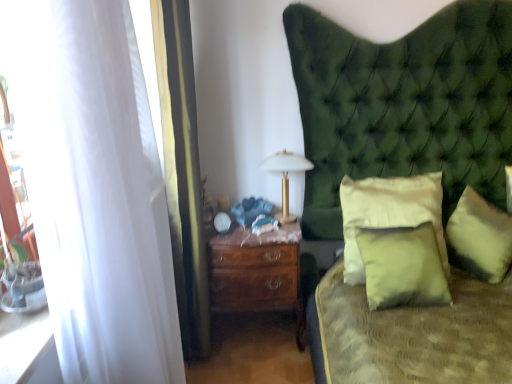
What are the coordinates of `soft cream pillow at center, which appears as the 2th pillow when viewed from the right` in the screenshot? It's located at (389, 213).

Measure the distance between point (265, 158) and camera.

They are 2.44 meters apart.

How much space does soft yellow fabric pillow at right, which is the 1th pillow in right-to-left order, occupy vertically?

soft yellow fabric pillow at right, which is the 1th pillow in right-to-left order, is 14.60 inches tall.

The image size is (512, 384). I want to click on mahogany wood nightstand at center, so click(x=257, y=272).

How far apart are soft yellow fabric pillow at right, which is the 1th pillow in right-to-left order, and white sheer curtain at left, placed as the second curtain when sorted from back to front?

The distance of soft yellow fabric pillow at right, which is the 1th pillow in right-to-left order, from white sheer curtain at left, placed as the second curtain when sorted from back to front, is 5.87 feet.

Is point (505, 223) closer to viewer compared to point (115, 200)?

No, it is not.

Between soft yellow fabric pillow at right, which is the 1th pillow in right-to-left order, and white sheer curtain at left, placed as the second curtain when sorted from back to front, which one has smaller size?

soft yellow fabric pillow at right, which is the 1th pillow in right-to-left order.

Does soft yellow fabric pillow at right, acting as the third pillow starting from the left, appear on the left side of white sheer curtain at left, placed as the second curtain when sorted from back to front?

In fact, soft yellow fabric pillow at right, acting as the third pillow starting from the left, is to the right of white sheer curtain at left, placed as the second curtain when sorted from back to front.

Is soft cream pillow at center, placed as the 2th pillow when sorted from left to right, wider or thinner than mahogany wood nightstand at center?

Clearly, soft cream pillow at center, placed as the 2th pillow when sorted from left to right, has less width compared to mahogany wood nightstand at center.

From the image's perspective, does soft cream pillow at center, placed as the 2th pillow when sorted from left to right, appear lower than mahogany wood nightstand at center?

No, from the image's perspective, soft cream pillow at center, placed as the 2th pillow when sorted from left to right, is not beneath mahogany wood nightstand at center.

Which is further, (381, 182) or (213, 244)?

Point (381, 182)

Is soft cream pillow at center, which appears as the 2th pillow when viewed from the right, looking in the opposite direction of mahogany wood nightstand at center?

soft cream pillow at center, which appears as the 2th pillow when viewed from the right, is not turned away from mahogany wood nightstand at center.

Is gold metallic bedside lamp at center far from white sheer curtain at left, the first curtain in the back-to-front sequence?

They are positioned close to each other.

From the image's perspective, which one is positioned lower, gold metallic bedside lamp at center or white sheer curtain at left, the first curtain in the back-to-front sequence?

white sheer curtain at left, the first curtain in the back-to-front sequence, appears lower in the image.

Based on their sizes in the image, would you say gold metallic bedside lamp at center is bigger or smaller than white sheer curtain at left, acting as the 2th curtain starting from the front?

Clearly, gold metallic bedside lamp at center is smaller in size than white sheer curtain at left, acting as the 2th curtain starting from the front.

Are white sheer curtain at left, which is the first curtain from front to back, and mahogany wood nightstand at center making contact?

No, white sheer curtain at left, which is the first curtain from front to back, is not next to mahogany wood nightstand at center.

How different are the orientations of white sheer curtain at left, placed as the second curtain when sorted from back to front, and mahogany wood nightstand at center in degrees?

There is a 89.5-degree angle between the facing directions of white sheer curtain at left, placed as the second curtain when sorted from back to front, and mahogany wood nightstand at center.

Which object is closer to the camera, white sheer curtain at left, which is the first curtain from front to back, or mahogany wood nightstand at center?

white sheer curtain at left, which is the first curtain from front to back, is closer to the camera.

Which object is wider, gold metallic bedside lamp at center or matte green pillow at center, marked as the third pillow in a right-to-left arrangement?

gold metallic bedside lamp at center.

Does gold metallic bedside lamp at center lie in front of matte green pillow at center, marked as the third pillow in a right-to-left arrangement?

No, gold metallic bedside lamp at center is further to the viewer.

Consider the image. Is gold metallic bedside lamp at center at the right side of matte green pillow at center, the 1th pillow from the left?

In fact, gold metallic bedside lamp at center is to the left of matte green pillow at center, the 1th pillow from the left.

Considering the points (85, 283) and (430, 175), which point is in front, point (85, 283) or point (430, 175)?

The point (85, 283) is closer to the camera.

Is white sheer curtain at left, placed as the second curtain when sorted from back to front, bigger or smaller than soft cream pillow at center, which appears as the 2th pillow when viewed from the right?

white sheer curtain at left, placed as the second curtain when sorted from back to front, is bigger than soft cream pillow at center, which appears as the 2th pillow when viewed from the right.

From the image's perspective, which is above, white sheer curtain at left, which is the first curtain from front to back, or soft cream pillow at center, placed as the 2th pillow when sorted from left to right?

soft cream pillow at center, placed as the 2th pillow when sorted from left to right, appears higher in the image.

Would you say white sheer curtain at left, placed as the second curtain when sorted from back to front, is inside or outside soft cream pillow at center, placed as the 2th pillow when sorted from left to right?

white sheer curtain at left, placed as the second curtain when sorted from back to front, is not inside soft cream pillow at center, placed as the 2th pillow when sorted from left to right, it's outside.

Between white sheer curtain at left, acting as the 2th curtain starting from the front, and matte green pillow at center, marked as the third pillow in a right-to-left arrangement, which one has less height?

Standing shorter between the two is matte green pillow at center, marked as the third pillow in a right-to-left arrangement.

Is white sheer curtain at left, acting as the 2th curtain starting from the front, in front of or behind matte green pillow at center, the 1th pillow from the left, in the image?

Visually, white sheer curtain at left, acting as the 2th curtain starting from the front, is located in front of matte green pillow at center, the 1th pillow from the left.

Based on the photo, which is more to the right, white sheer curtain at left, acting as the 2th curtain starting from the front, or matte green pillow at center, marked as the third pillow in a right-to-left arrangement?

From the viewer's perspective, matte green pillow at center, marked as the third pillow in a right-to-left arrangement, appears more on the right side.

Which pillow is the 2nd one when counting from the back of the white sheer curtain at left, placed as the second curtain when sorted from back to front? Please provide its 2D coordinates.

[(479, 238)]

The width and height of the screenshot is (512, 384). Identify the location of nightstand beneath the soft cream pillow at center, placed as the 2th pillow when sorted from left to right (from a real-world perspective). (257, 272).

From the image, which object appears to be nearer to white sheer curtain at left, acting as the 2th curtain starting from the front, soft yellow fabric pillow at right, which is the 1th pillow in right-to-left order, or matte green pillow at center, the 1th pillow from the left?

Among the two, matte green pillow at center, the 1th pillow from the left, is located nearer to white sheer curtain at left, acting as the 2th curtain starting from the front.

Which object lies further to the anchor point gold metallic bedside lamp at center, matte green pillow at center, the 1th pillow from the left, or white sheer curtain at left, the first curtain in the back-to-front sequence?

Based on the image, matte green pillow at center, the 1th pillow from the left, appears to be further to gold metallic bedside lamp at center.

Based on their spatial positions, is soft cream pillow at center, placed as the 2th pillow when sorted from left to right, or gold metallic bedside lamp at center further from mahogany wood nightstand at center?

soft cream pillow at center, placed as the 2th pillow when sorted from left to right.

Estimate the real-world distances between objects in this image. Which object is closer to soft yellow fabric pillow at right, acting as the third pillow starting from the left, white sheer curtain at left, placed as the second curtain when sorted from back to front, or white sheer curtain at left, the first curtain in the back-to-front sequence?

white sheer curtain at left, the first curtain in the back-to-front sequence.

When comparing their distances from white sheer curtain at left, acting as the 2th curtain starting from the front, does matte green pillow at center, marked as the third pillow in a right-to-left arrangement, or gold metallic bedside lamp at center seem further?

Based on the image, matte green pillow at center, marked as the third pillow in a right-to-left arrangement, appears to be further to white sheer curtain at left, acting as the 2th curtain starting from the front.

Estimate the real-world distances between objects in this image. Which object is closer to white sheer curtain at left, the first curtain in the back-to-front sequence, matte green pillow at center, marked as the third pillow in a right-to-left arrangement, or soft cream pillow at center, which appears as the 2th pillow when viewed from the right?

The object closer to white sheer curtain at left, the first curtain in the back-to-front sequence, is soft cream pillow at center, which appears as the 2th pillow when viewed from the right.

Considering their positions, is mahogany wood nightstand at center positioned further to matte green pillow at center, marked as the third pillow in a right-to-left arrangement, than white sheer curtain at left, placed as the second curtain when sorted from back to front?

Among the two, white sheer curtain at left, placed as the second curtain when sorted from back to front, is located further to matte green pillow at center, marked as the third pillow in a right-to-left arrangement.

Looking at the image, which one is located further to mahogany wood nightstand at center, gold metallic bedside lamp at center or matte green pillow at center, the 1th pillow from the left?

Based on the image, matte green pillow at center, the 1th pillow from the left, appears to be further to mahogany wood nightstand at center.

Find the location of `bedside lamp between white sheer curtain at left, the first curtain in the back-to-front sequence, and soft cream pillow at center, which appears as the 2th pillow when viewed from the right, from left to right`. bedside lamp between white sheer curtain at left, the first curtain in the back-to-front sequence, and soft cream pillow at center, which appears as the 2th pillow when viewed from the right, from left to right is located at coordinates (286, 176).

Where is `bedside lamp between mahogany wood nightstand at center and matte green pillow at center, the 1th pillow from the left, from left to right`? This screenshot has width=512, height=384. bedside lamp between mahogany wood nightstand at center and matte green pillow at center, the 1th pillow from the left, from left to right is located at coordinates (286, 176).

Locate an element on the screen. The image size is (512, 384). pillow situated between mahogany wood nightstand at center and soft cream pillow at center, placed as the 2th pillow when sorted from left to right, from left to right is located at coordinates (403, 267).

Identify the location of curtain between white sheer curtain at left, which is the first curtain from front to back, and soft cream pillow at center, which appears as the 2th pillow when viewed from the right, along the z-axis. (182, 170).